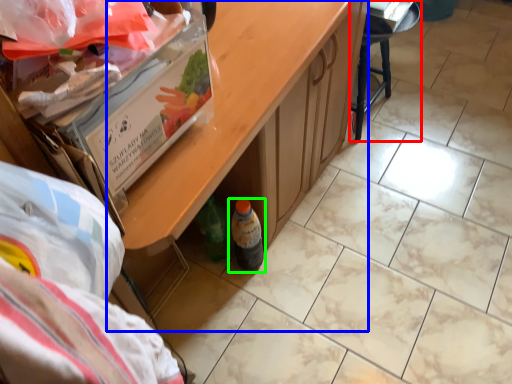
Question: Estimate the real-world distances between objects in this image. Which object is closer to furniture (highlighted by a red box), table (highlighted by a blue box) or bottle (highlighted by a green box)?

Choices:
 (A) table
 (B) bottle

Answer: (A)